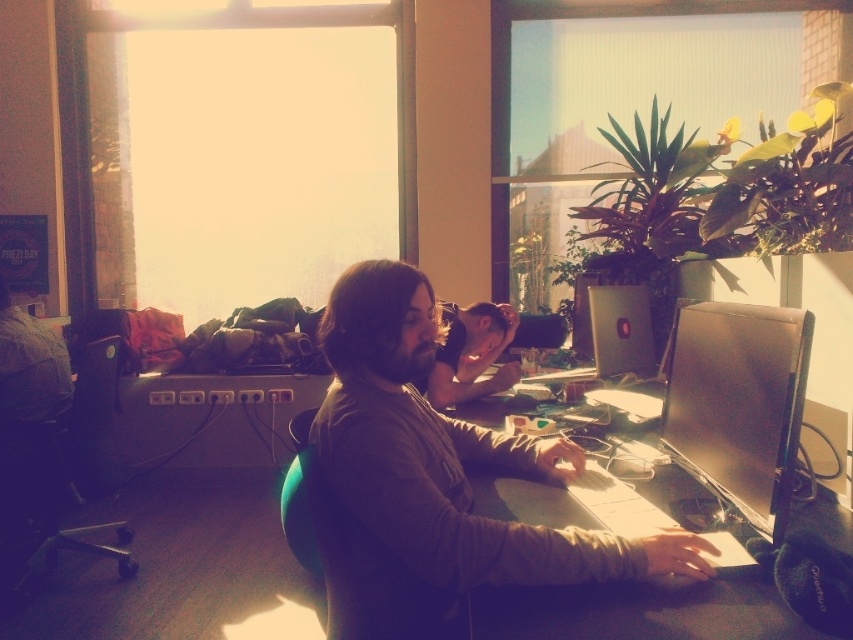
You are a delivery person standing at the entrance of the office. You need to place a package on the desk without moving any items. The package is 0.8 meters in length. Is there enough space between the black glossy monitor at center and the edge of the desk closest to you to place the package?

The black glossy monitor at center is 1.02 meters away from the camera. Since the package is 0.8 meters long, there is sufficient space between the monitor and the edge of the desk closest to you to place the package.

From the picture: You are organizing the desk and need to place a new stand that requires at least 10 cm of vertical space between the top of the black glossy monitor at center and the matte black laptop at center. Can the stand fit between them?

The black glossy monitor at center is taller than the matte black laptop at center, so there is sufficient vertical space between them for the stand to fit.

You are a photographer trying to capture a photo of the matte brown shirt at center and the smooth wooden table at center. Which object should you focus on first if you want to ensure both are in focus?

The matte brown shirt at center is taller than the smooth wooden table at center, so focusing on the shirt first would ensure both are in focus as the table is shorter and closer to the camera.